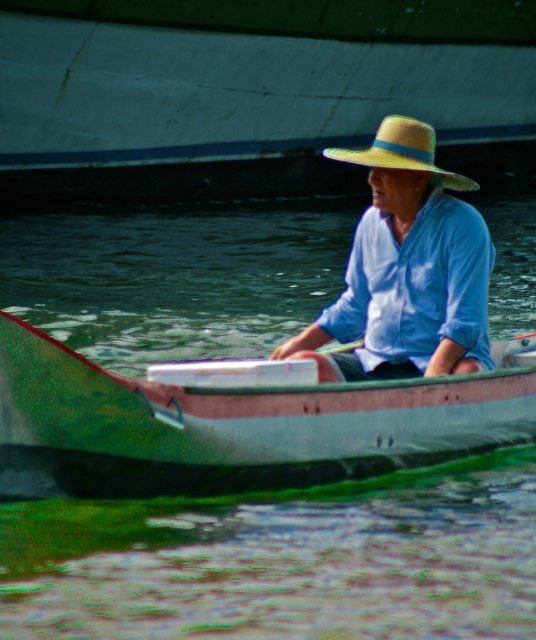
Question: Which point is closer to the camera?

Choices:
 (A) light blue cotton shirt at center
 (B) natural straw hat at center

Answer: (A)

Question: Considering the relative positions of green painted wood canoe at center and natural straw hat at center in the image provided, where is green painted wood canoe at center located with respect to natural straw hat at center?

Choices:
 (A) right
 (B) left

Answer: (B)

Question: Is green matte water at center positioned behind natural straw hat at center?

Choices:
 (A) no
 (B) yes

Answer: (A)

Question: Does green matte water at center appear over green painted wood canoe at center?

Choices:
 (A) no
 (B) yes

Answer: (B)

Question: Among these points, which one is nearest to the camera?

Choices:
 (A) (199, 456)
 (B) (317, 220)
 (C) (423, 20)

Answer: (A)

Question: Which point is farther to the camera?

Choices:
 (A) (107, 172)
 (B) (452, 188)

Answer: (A)